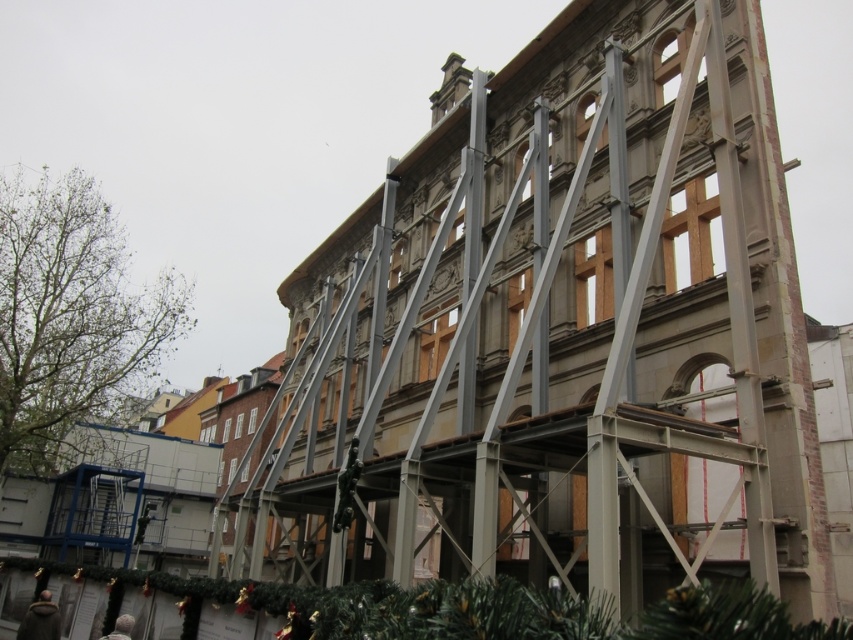
You are a construction worker who needs to move a 1.2 meter wide tool box from the dark gray fabric at lower left to the dark gray coat at lower center. Based on the scene, can the tool box fit through the space between them?

The dark gray coat at lower center might be wider than the dark gray fabric at lower left, so the space between them may be sufficient to allow the 1.2 meter wide tool box to pass through.